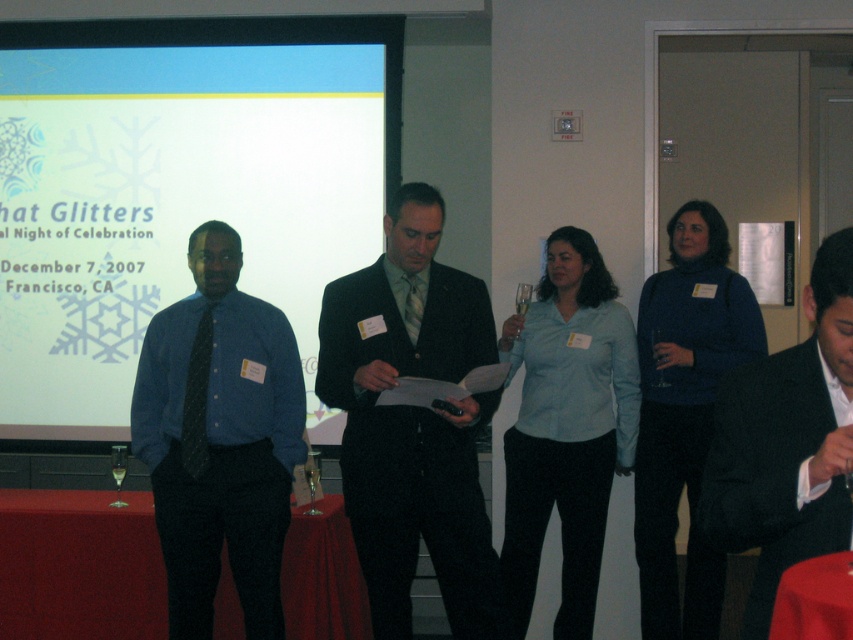
Question: Can you confirm if dark suit at center is positioned below black suit at center?

Choices:
 (A) yes
 (B) no

Answer: (A)

Question: Which point appears closest to the camera in this image?

Choices:
 (A) (x=457, y=515)
 (B) (x=15, y=518)
 (C) (x=318, y=80)

Answer: (A)

Question: Does white paper at upper left have a lesser width compared to red fabric table at lower left?

Choices:
 (A) yes
 (B) no

Answer: (B)

Question: Does matte blue shirt at left appear on the left side of smooth red tablecloth at lower right?

Choices:
 (A) no
 (B) yes

Answer: (B)

Question: Among these objects, which one is farthest from the camera?

Choices:
 (A) red fabric table at lower left
 (B) black suit at center
 (C) blue sweater at center
 (D) matte blue shirt at left

Answer: (C)

Question: Which point is farther to the camera?

Choices:
 (A) (466, 499)
 (B) (619, 348)

Answer: (B)